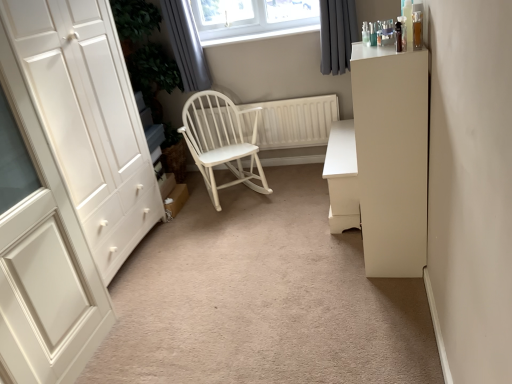
Identify the location of free space between white wood rocking chair at center and white matte cabinet at right. The image size is (512, 384). (291, 218).